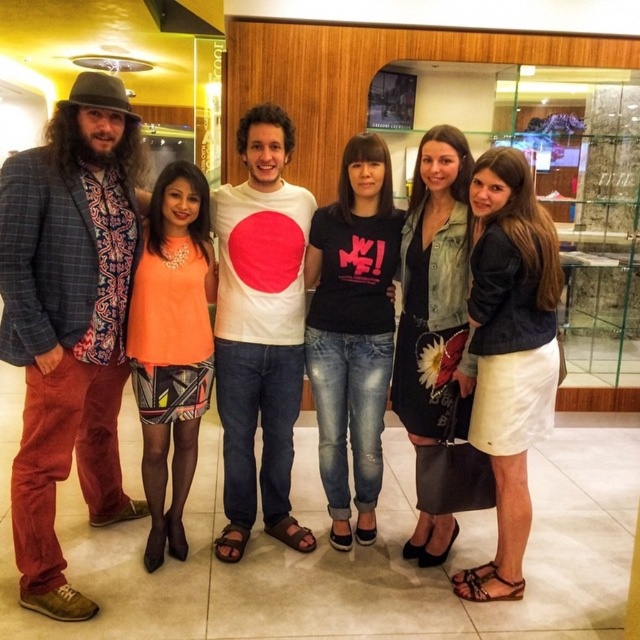
In the scene shown: You are standing in the shopping mall and see two points marked on the floor. The first point is at coordinate point(504, 244) and the second point is at point(484, 460). If you are facing the glass display case, which point is closer to you?

Point(504, 244) is in front of point(484, 460), so if you are facing the glass display case, point(504, 244) is closer to you.